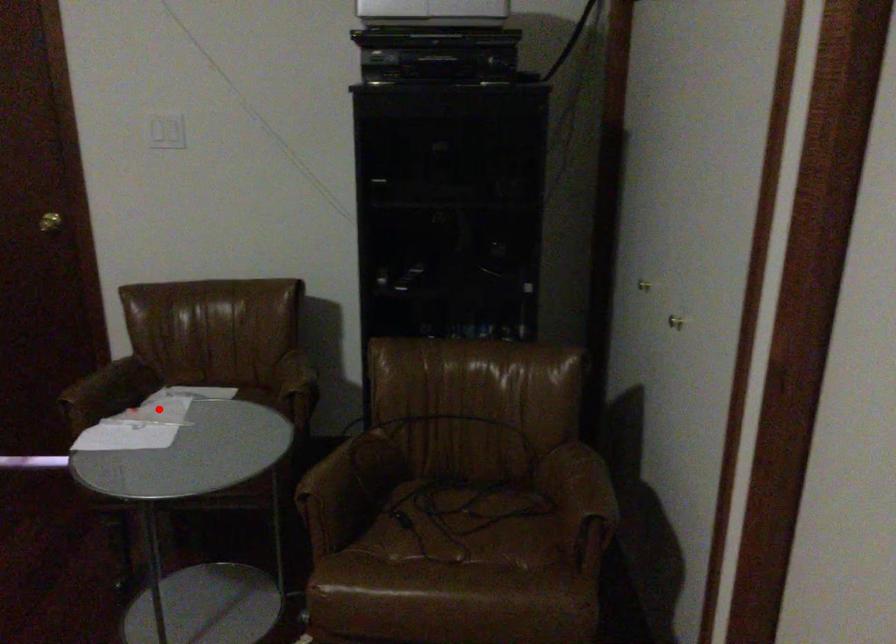
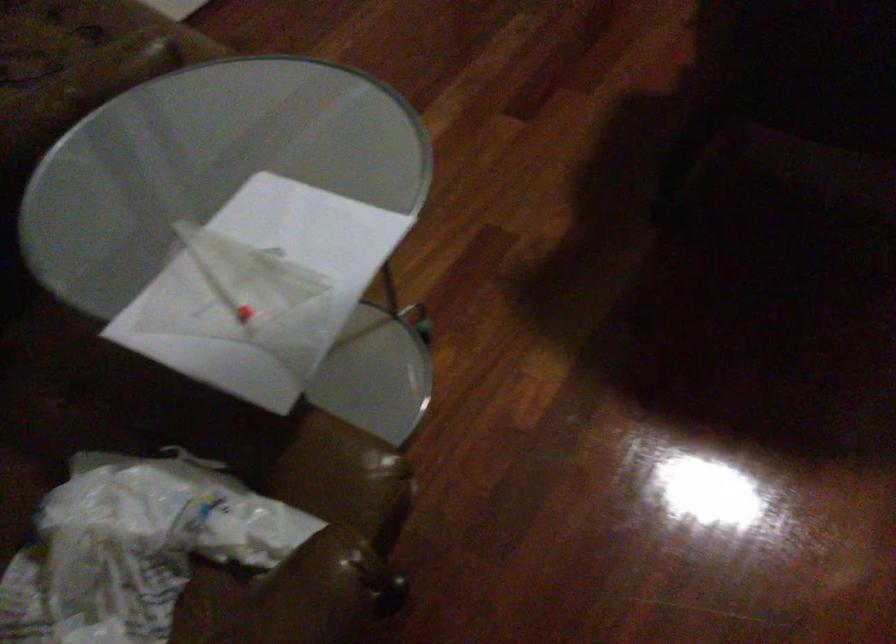
The point at the highlighted location is marked in the first image. Where is the corresponding point in the second image?

(134, 547)